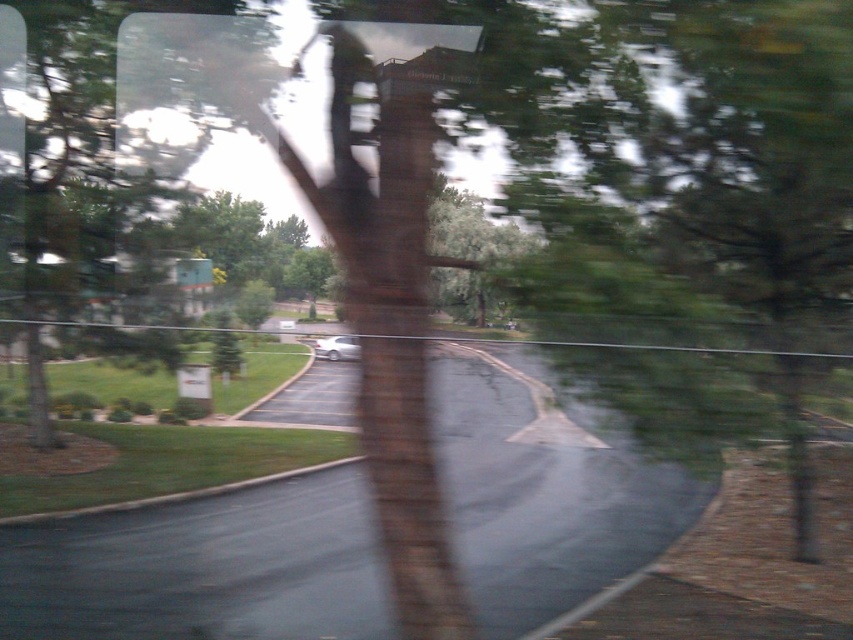
You are a passenger in a moving car and notice the green leafy tree at center and the satin silver car at center outside the window. Which object appears larger in the scene?

The green leafy tree at center appears larger than the satin silver car at center in the scene.

Based on the scene description, where is the green leafy tree at center located in the image coordinates?

The green leafy tree at center is located at point coordinates of [471,228].

You are sitting in a car and looking out the window. You see a green leafy tree at center. Where is the point located at coordinates (471,228) in relation to the green leafy tree at center?

The point located at coordinates (471,228) corresponds to the green leafy tree at center.